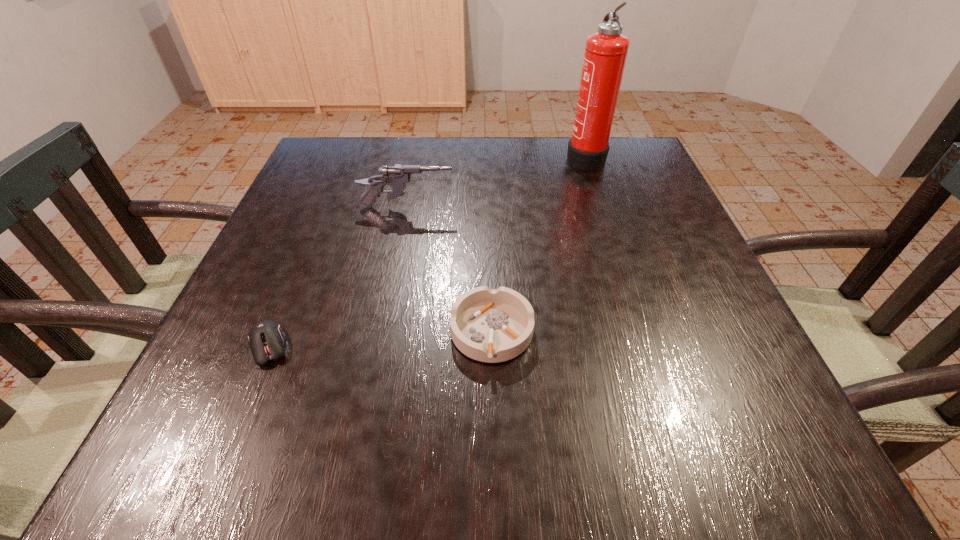
In order to click on vacant space that satisfies the following two spatial constraints: 1. on the front-facing side of the rightmost object; 2. on the front side of the computer mouse in this screenshot , I will do `click(646, 347)`.